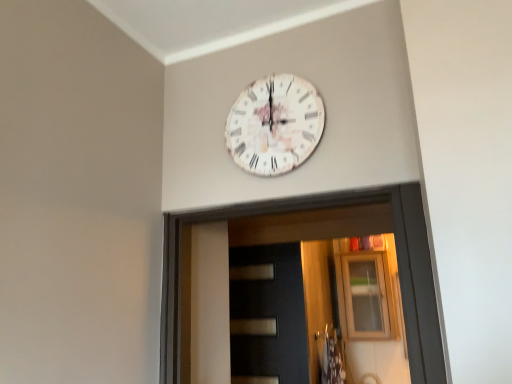
Where is `transparent glass cabinet at upper center`? This screenshot has width=512, height=384. transparent glass cabinet at upper center is located at coordinates (365, 296).

Identify the location of transparent glass cabinet at upper center. The width and height of the screenshot is (512, 384). (365, 296).

Considering the relative positions of dark matte door at center and white paper-like clock at upper center in the image provided, is dark matte door at center behind white paper-like clock at upper center?

Yes, it is.

Which of these two, dark matte door at center or white paper-like clock at upper center, is smaller?

white paper-like clock at upper center is smaller.

Is dark matte door at center next to white paper-like clock at upper center and touching it?

No, dark matte door at center is not in contact with white paper-like clock at upper center.

Between dark matte door at center and white paper-like clock at upper center, which one appears on the right side from the viewer's perspective?

Positioned to the right is white paper-like clock at upper center.

Which is more to the right, white paper-like clock at upper center or dark matte door at center?

Positioned to the right is white paper-like clock at upper center.

Is white paper-like clock at upper center aimed at dark matte door at center?

No, white paper-like clock at upper center is not oriented towards dark matte door at center.

Who is taller, white paper-like clock at upper center or dark matte door at center?

With more height is dark matte door at center.

Is point (298, 119) positioned in front of point (272, 244)?

Yes, point (298, 119) is in front of point (272, 244).

Is dark matte door at center outside of transparent glass cabinet at upper center?

dark matte door at center lies outside transparent glass cabinet at upper center's area.

Between dark matte door at center and transparent glass cabinet at upper center, which one has more height?

With more height is dark matte door at center.

Is dark matte door at center aimed at transparent glass cabinet at upper center?

No, dark matte door at center is not facing towards transparent glass cabinet at upper center.

Does dark matte door at center have a greater width compared to transparent glass cabinet at upper center?

No.

Considering the relative sizes of white paper-like clock at upper center and transparent glass cabinet at upper center in the image provided, is white paper-like clock at upper center wider than transparent glass cabinet at upper center?

No, white paper-like clock at upper center is not wider than transparent glass cabinet at upper center.

Based on the photo, which point is more distant from viewer, (266,105) or (356,308)?

The point (356,308) is more distant.

Is white paper-like clock at upper center to the left or to the right of transparent glass cabinet at upper center in the image?

Based on their positions, white paper-like clock at upper center is located to the left of transparent glass cabinet at upper center.

From the image's perspective, is white paper-like clock at upper center located above transparent glass cabinet at upper center?

Yes.

Is transparent glass cabinet at upper center positioned with its back to white paper-like clock at upper center?

No, transparent glass cabinet at upper center is not facing away from white paper-like clock at upper center.

Is point (356, 335) in front of point (280, 122)?

No.

Is transparent glass cabinet at upper center touching white paper-like clock at upper center?

No, transparent glass cabinet at upper center is not beside white paper-like clock at upper center.

Which point is more forward, (349,330) or (263,360)?

Point (263,360)

Is transparent glass cabinet at upper center turned away from dark matte door at center?

transparent glass cabinet at upper center is not turned away from dark matte door at center.

Between transparent glass cabinet at upper center and dark matte door at center, which one has more height?

Standing taller between the two is dark matte door at center.

Which object is further away from the camera taking this photo, transparent glass cabinet at upper center or dark matte door at center?

transparent glass cabinet at upper center is behind.

In order to click on wall clock on the right of dark matte door at center in this screenshot , I will do `click(275, 125)`.

The width and height of the screenshot is (512, 384). In order to click on wall clock above the dark matte door at center (from a real-world perspective) in this screenshot , I will do `click(275, 125)`.

Based on their spatial positions, is transparent glass cabinet at upper center or white paper-like clock at upper center further from dark matte door at center?

white paper-like clock at upper center is positioned further to the anchor dark matte door at center.

Which object lies further to the anchor point dark matte door at center, white paper-like clock at upper center or transparent glass cabinet at upper center?

Among the two, white paper-like clock at upper center is located further to dark matte door at center.

Which object lies further to the anchor point white paper-like clock at upper center, dark matte door at center or transparent glass cabinet at upper center?

transparent glass cabinet at upper center is further to white paper-like clock at upper center.

Looking at the image, which one is located closer to transparent glass cabinet at upper center, white paper-like clock at upper center or dark matte door at center?

Based on the image, dark matte door at center appears to be nearer to transparent glass cabinet at upper center.

When comparing their distances from white paper-like clock at upper center, does transparent glass cabinet at upper center or dark matte door at center seem closer?

The object closer to white paper-like clock at upper center is dark matte door at center.

When comparing their distances from transparent glass cabinet at upper center, does dark matte door at center or white paper-like clock at upper center seem further?

Among the two, white paper-like clock at upper center is located further to transparent glass cabinet at upper center.

At what (x,y) coordinates should I click in order to perform the action: click on door between white paper-like clock at upper center and transparent glass cabinet at upper center along the z-axis. Please return your answer as a coordinate pair (x, y). This screenshot has width=512, height=384. Looking at the image, I should click on (268, 315).